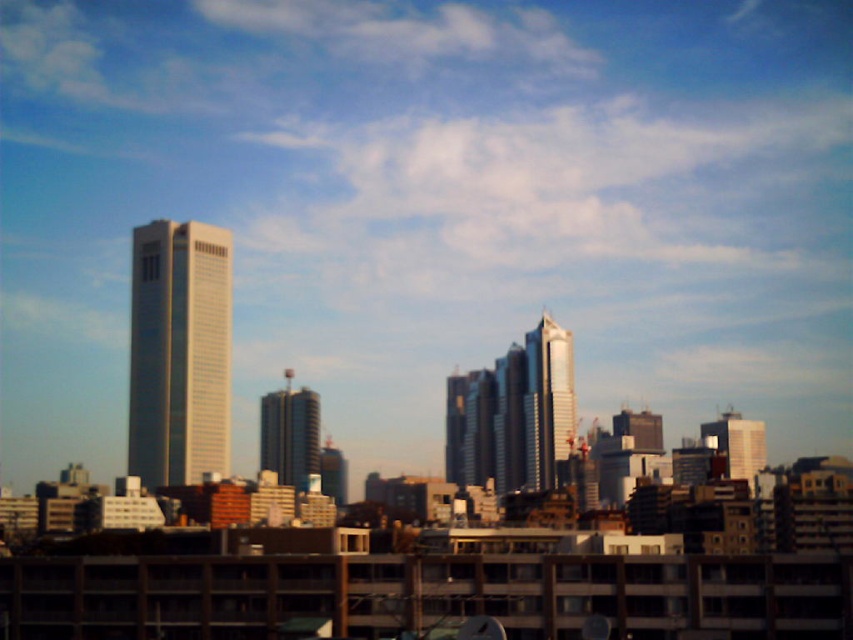
Question: Which is nearer to the shiny silver skyscraper at center?

Choices:
 (A) metallic glass building at center
 (B) white glossy building at left

Answer: (A)

Question: Which is nearer to the white glossy building at left?

Choices:
 (A) shiny silver skyscraper at center
 (B) metallic glass building at center

Answer: (B)

Question: Is white glossy building at left positioned in front of shiny silver skyscraper at center?

Choices:
 (A) no
 (B) yes

Answer: (B)

Question: Does white glossy building at left appear on the right side of metallic glass building at center?

Choices:
 (A) yes
 (B) no

Answer: (B)

Question: Is white glossy building at left to the right of shiny silver skyscraper at center from the viewer's perspective?

Choices:
 (A) yes
 (B) no

Answer: (B)

Question: Estimate the real-world distances between objects in this image. Which object is farther from the white glossy building at left?

Choices:
 (A) shiny silver skyscraper at center
 (B) metallic glass building at center

Answer: (A)